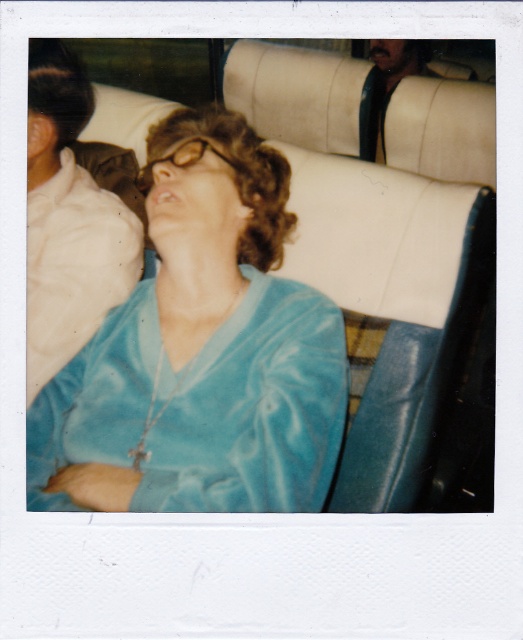
Between satin blue robe at center and leather at upper right, which one appears on the right side from the viewer's perspective?

leather at upper right

This screenshot has height=640, width=523. What are the coordinates of `satin blue robe at center` in the screenshot? It's located at (73, 266).

Is velvet blue blouse at center closer to the viewer compared to leather at upper right?

Yes, it is.

Does point (323, 390) come farther from viewer compared to point (366, 148)?

No.

The width and height of the screenshot is (523, 640). What are the coordinates of `velvet blue blouse at center` in the screenshot? It's located at (201, 352).

The height and width of the screenshot is (640, 523). I want to click on velvet blue blouse at center, so click(x=201, y=352).

Can you confirm if velvet blue blouse at center is positioned to the left of satin blue robe at center?

No, velvet blue blouse at center is not to the left of satin blue robe at center.

Does velvet blue blouse at center have a lesser width compared to satin blue robe at center?

No.

Measure the distance between point [333,456] and camera.

Point [333,456] and camera are 38.01 inches apart.

Locate an element on the screen. velvet blue blouse at center is located at coordinates (201, 352).